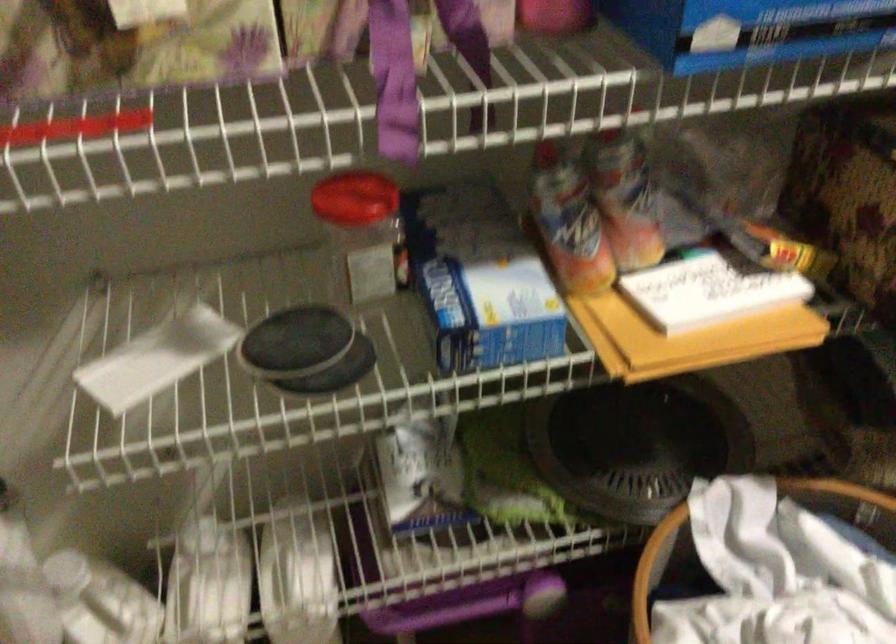
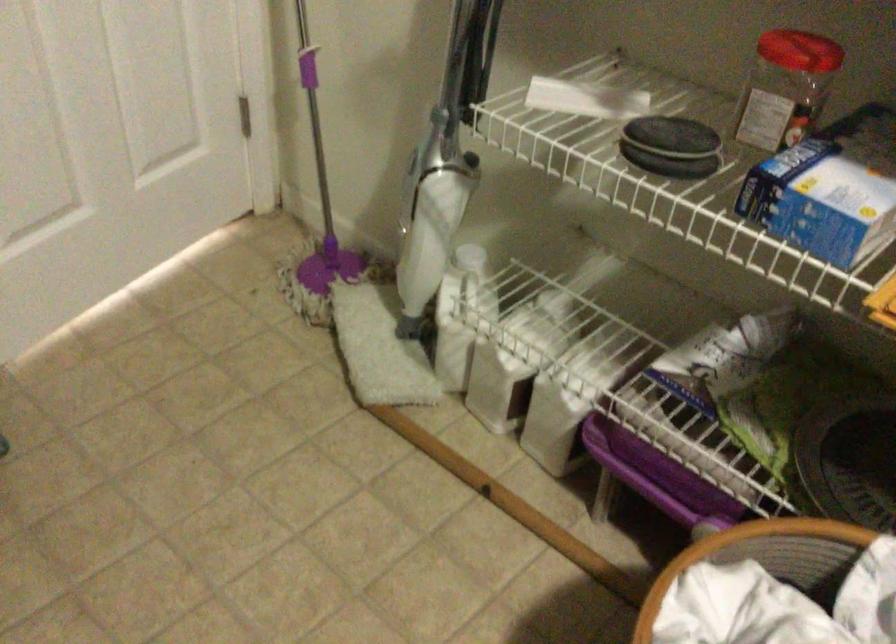
Question: The camera is either moving clockwise (left) or counter-clockwise (right) around the object. The first image is from the beginning of the video and the second image is from the end. Is the camera moving left or right when shooting the video?

Choices:
 (A) Left
 (B) Right

Answer: (B)